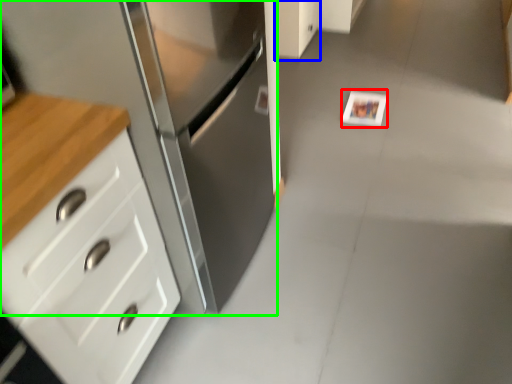
Question: Estimate the real-world distances between objects in this image. Which object is closer to postcard (highlighted by a red box), cabinetry (highlighted by a blue box) or cabinetry (highlighted by a green box)?

Choices:
 (A) cabinetry
 (B) cabinetry

Answer: (A)